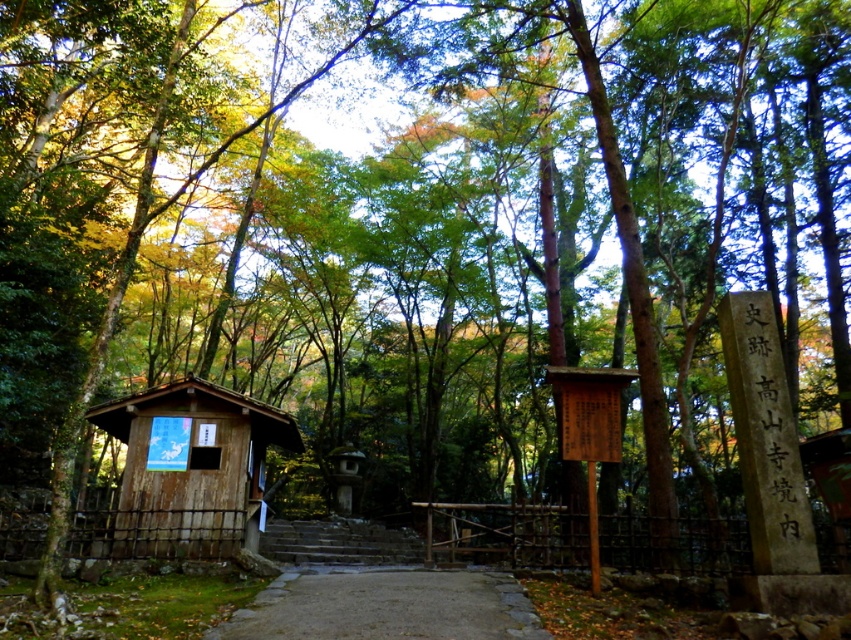
Question: Which object appears closest to the camera in this image?

Choices:
 (A) smooth stone path at center
 (B) wooden hut at center
 (C) stone steps at center

Answer: (A)

Question: Is wooden hut at center thinner than stone steps at center?

Choices:
 (A) no
 (B) yes

Answer: (B)

Question: Does smooth stone path at center appear on the right side of stone steps at center?

Choices:
 (A) no
 (B) yes

Answer: (B)

Question: Which object is closer to the camera taking this photo?

Choices:
 (A) wooden hut at center
 (B) smooth stone path at center

Answer: (B)

Question: Which point is farther to the camera?

Choices:
 (A) stone steps at center
 (B) smooth stone path at center
 (C) wooden hut at center

Answer: (A)

Question: Is wooden hut at center behind smooth stone path at center?

Choices:
 (A) yes
 (B) no

Answer: (A)